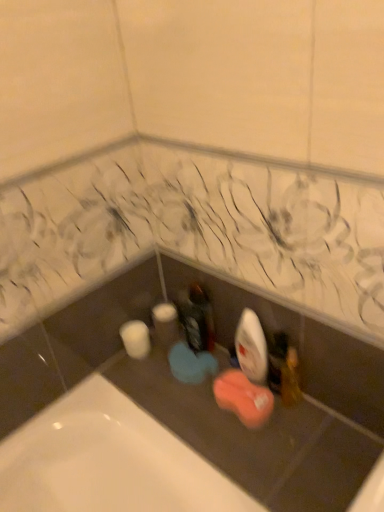
The width and height of the screenshot is (384, 512). Describe the element at coordinates (136, 339) in the screenshot. I see `white matte toilet paper at lower left` at that location.

In order to click on matte black bottle at center in this screenshot , I will do `click(197, 318)`.

This screenshot has height=512, width=384. I want to click on toilet paper below the matte black bottle at center (from a real-world perspective), so click(x=136, y=339).

From the image's perspective, would you say matte black bottle at center is shown under white matte toilet paper at lower left?

Actually, matte black bottle at center appears above white matte toilet paper at lower left in the image.

Is matte black bottle at center in contact with white matte toilet paper at lower left?

matte black bottle at center is not next to white matte toilet paper at lower left, and they're not touching.

Who is bigger, matte black bottle at center or white matte toilet paper at lower left?

white matte toilet paper at lower left.

Between white matte toilet paper at lower left and wooden toothbrush at lower right, which one is positioned in front?

Positioned in front is wooden toothbrush at lower right.

From the image's perspective, is white matte toilet paper at lower left above wooden toothbrush at lower right?

Yes.

Considering the sizes of objects white matte toilet paper at lower left and wooden toothbrush at lower right in the image provided, who is smaller, white matte toilet paper at lower left or wooden toothbrush at lower right?

With smaller size is wooden toothbrush at lower right.

Can you tell me how much white matte toilet paper at lower left and wooden toothbrush at lower right differ in facing direction?

There is a 0.00484-degree angle between the facing directions of white matte toilet paper at lower left and wooden toothbrush at lower right.

Considering the relative sizes of wooden toothbrush at lower right and white matte toilet paper at lower left in the image provided, is wooden toothbrush at lower right shorter than white matte toilet paper at lower left?

In fact, wooden toothbrush at lower right may be taller than white matte toilet paper at lower left.

Looking at this image, is wooden toothbrush at lower right in front of or behind white matte toilet paper at lower left in the image?

Visually, wooden toothbrush at lower right is located in front of white matte toilet paper at lower left.

The image size is (384, 512). Find the location of `toilet paper on the left of wooden toothbrush at lower right`. toilet paper on the left of wooden toothbrush at lower right is located at coordinates coord(136,339).

Is the surface of wooden toothbrush at lower right in direct contact with white matte toilet paper at lower left?

No, wooden toothbrush at lower right is not touching white matte toilet paper at lower left.

Considering the positions of point (200, 311) and point (295, 366), is point (200, 311) closer or farther from the camera than point (295, 366)?

Point (200, 311).

How distant is matte black bottle at center from wooden toothbrush at lower right?

matte black bottle at center is 10.63 inches from wooden toothbrush at lower right.

Could you tell me if matte black bottle at center is facing wooden toothbrush at lower right?

No, matte black bottle at center is not turned towards wooden toothbrush at lower right.

Does matte black bottle at center appear on the left side of wooden toothbrush at lower right?

Yes, matte black bottle at center is to the left of wooden toothbrush at lower right.

Considering the sizes of objects white matte toilet paper at lower left and matte black bottle at center in the image provided, who is thinner, white matte toilet paper at lower left or matte black bottle at center?

matte black bottle at center.

Considering the sizes of objects white matte toilet paper at lower left and matte black bottle at center in the image provided, who is bigger, white matte toilet paper at lower left or matte black bottle at center?

white matte toilet paper at lower left is bigger.

From the image's perspective, between white matte toilet paper at lower left and matte black bottle at center, who is located below?

From the image's view, white matte toilet paper at lower left is below.

Locate an element on the screen. toiletry located underneath the matte black bottle at center (from a real-world perspective) is located at coordinates (291, 379).

Is wooden toothbrush at lower right next to matte black bottle at center?

No, wooden toothbrush at lower right is not with matte black bottle at center.

Is wooden toothbrush at lower right in front of or behind matte black bottle at center in the image?

wooden toothbrush at lower right is positioned closer to the viewer than matte black bottle at center.

Considering the relative sizes of wooden toothbrush at lower right and matte black bottle at center in the image provided, is wooden toothbrush at lower right smaller than matte black bottle at center?

Yes, wooden toothbrush at lower right is smaller than matte black bottle at center.

You are a GUI agent. You are given a task and a screenshot of the screen. Output one action in this format:
    pyautogui.click(x=<x>, y=<y>)
    Task: Click on the bottle located above the white matte toilet paper at lower left (from the image's perspective)
    
    Given the screenshot: What is the action you would take?
    pyautogui.click(x=197, y=318)

You are a GUI agent. You are given a task and a screenshot of the screen. Output one action in this format:
    pyautogui.click(x=<x>, y=<y>)
    Task: Click on the toiletry lying below the white matte toilet paper at lower left (from the image's perspective)
    
    Given the screenshot: What is the action you would take?
    pyautogui.click(x=291, y=379)

Based on their spatial positions, is white matte toilet paper at lower left or wooden toothbrush at lower right further from matte black bottle at center?

wooden toothbrush at lower right is further to matte black bottle at center.

Looking at the image, which one is located further to matte black bottle at center, wooden toothbrush at lower right or white matte toilet paper at lower left?

wooden toothbrush at lower right is further to matte black bottle at center.

Estimate the real-world distances between objects in this image. Which object is further from wooden toothbrush at lower right, white matte toilet paper at lower left or matte black bottle at center?

white matte toilet paper at lower left.

From the image, which object appears to be nearer to wooden toothbrush at lower right, matte black bottle at center or white matte toilet paper at lower left?

The object closer to wooden toothbrush at lower right is matte black bottle at center.

Based on their spatial positions, is matte black bottle at center or wooden toothbrush at lower right closer to white matte toilet paper at lower left?

Among the two, matte black bottle at center is located nearer to white matte toilet paper at lower left.

From the image, which object appears to be farther from white matte toilet paper at lower left, wooden toothbrush at lower right or matte black bottle at center?

wooden toothbrush at lower right is further to white matte toilet paper at lower left.

I want to click on bottle between white matte toilet paper at lower left and wooden toothbrush at lower right, so click(x=197, y=318).